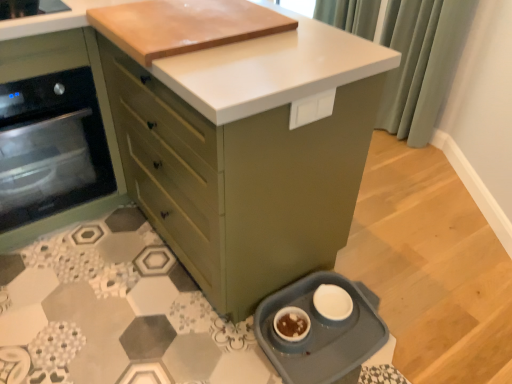
In order to face blue plastic pet dish at lower right, should I rotate leftwards or rightwards?

It's best to rotate right around 9.810 degrees.

Where is `matte green cabinet at center, arranged as the second cabinetry when viewed from the left`? matte green cabinet at center, arranged as the second cabinetry when viewed from the left is located at coordinates (234, 146).

What do you see at coordinates (292, 323) in the screenshot? I see `white matte bowl at lower center` at bounding box center [292, 323].

This screenshot has height=384, width=512. I want to click on blue plastic pet dish at lower right, so click(322, 333).

From a real-world perspective, which object rests below the other?

blue plastic pet dish at lower right is physically lower.

From the image's perspective, is matte green cabinet at center, the first cabinetry viewed from the right, under blue plastic pet dish at lower right?

No.

In terms of size, does matte green cabinet at center, the first cabinetry viewed from the right, appear bigger or smaller than blue plastic pet dish at lower right?

In the image, matte green cabinet at center, the first cabinetry viewed from the right, appears to be larger than blue plastic pet dish at lower right.

Measure the distance between white matte bowl at lower center and matte green oven at left, the second cabinetry viewed from the right.

They are 1.08 meters apart.

Based on their positions, is white matte bowl at lower center located to the left or right of matte green oven at left, the second cabinetry viewed from the right?

In the image, white matte bowl at lower center appears on the right side of matte green oven at left, the second cabinetry viewed from the right.

What are the coordinates of `appliance below the matte green oven at left, the second cabinetry viewed from the right (from a real-world perspective)` in the screenshot? It's located at (292, 323).

Is white matte bowl at lower center bigger or smaller than matte green oven at left, the 1th cabinetry in the left-to-right sequence?

white matte bowl at lower center is smaller than matte green oven at left, the 1th cabinetry in the left-to-right sequence.

Considering the sizes of objects matte green oven at left, the 1th cabinetry in the left-to-right sequence, and green fabric curtain at upper right in the image provided, who is shorter, matte green oven at left, the 1th cabinetry in the left-to-right sequence, or green fabric curtain at upper right?

Standing shorter between the two is matte green oven at left, the 1th cabinetry in the left-to-right sequence.

Considering the positions of point (108, 126) and point (403, 124), is point (108, 126) closer or farther from the camera than point (403, 124)?

Clearly, point (108, 126) is closer to the camera than point (403, 124).

Relative to green fabric curtain at upper right, is matte green oven at left, the second cabinetry viewed from the right, in front or behind?

matte green oven at left, the second cabinetry viewed from the right, is in front of green fabric curtain at upper right.

From the image's perspective, between blue plastic pet dish at lower right and white matte bowl at lower center, which one is located above?

blue plastic pet dish at lower right appears higher in the image.

Is point (348, 291) farther from camera compared to point (278, 319)?

Yes.

Is blue plastic pet dish at lower right not within white matte bowl at lower center?

blue plastic pet dish at lower right is positioned outside white matte bowl at lower center.

Based on the photo, in terms of height, does blue plastic pet dish at lower right look taller or shorter compared to white matte bowl at lower center?

Clearly, blue plastic pet dish at lower right is taller compared to white matte bowl at lower center.

Considering the sizes of objects matte green cabinet at center, the first cabinetry viewed from the right, and white matte bowl at lower center in the image provided, who is smaller, matte green cabinet at center, the first cabinetry viewed from the right, or white matte bowl at lower center?

white matte bowl at lower center is smaller.

How distant is matte green cabinet at center, the first cabinetry viewed from the right, from white matte bowl at lower center?

They are 25.40 inches apart.

Is matte green cabinet at center, the first cabinetry viewed from the right, further to camera compared to white matte bowl at lower center?

No, the depth of matte green cabinet at center, the first cabinetry viewed from the right, is less than that of white matte bowl at lower center.

Is white matte bowl at lower center located within matte green cabinet at center, arranged as the second cabinetry when viewed from the left?

No, matte green cabinet at center, arranged as the second cabinetry when viewed from the left, does not contain white matte bowl at lower center.

Is blue plastic pet dish at lower right wider than matte green cabinet at center, the first cabinetry viewed from the right?

In fact, blue plastic pet dish at lower right might be narrower than matte green cabinet at center, the first cabinetry viewed from the right.

Identify the location of the 2nd cabinetry above when counting from the blue plastic pet dish at lower right (from the image's perspective). Image resolution: width=512 pixels, height=384 pixels. (234, 146).

In the scene shown: Considering the relative sizes of blue plastic pet dish at lower right and matte green cabinet at center, arranged as the second cabinetry when viewed from the left, in the image provided, is blue plastic pet dish at lower right smaller than matte green cabinet at center, arranged as the second cabinetry when viewed from the left,?

Indeed, blue plastic pet dish at lower right has a smaller size compared to matte green cabinet at center, arranged as the second cabinetry when viewed from the left.

Identify the location of kitchen appliance below the matte green oven at left, the second cabinetry viewed from the right (from a real-world perspective). (x=322, y=333).

Is matte green oven at left, the second cabinetry viewed from the right, situated inside blue plastic pet dish at lower right or outside?

matte green oven at left, the second cabinetry viewed from the right, cannot be found inside blue plastic pet dish at lower right.

Considering the positions of objects matte green oven at left, the 1th cabinetry in the left-to-right sequence, and blue plastic pet dish at lower right in the image provided, who is in front, matte green oven at left, the 1th cabinetry in the left-to-right sequence, or blue plastic pet dish at lower right?

blue plastic pet dish at lower right is in front.

From the picture: From the image's perspective, is matte green oven at left, the 1th cabinetry in the left-to-right sequence, positioned above or below blue plastic pet dish at lower right?

Clearly, from the image's perspective, matte green oven at left, the 1th cabinetry in the left-to-right sequence, is above blue plastic pet dish at lower right.

Where is `cabinetry in front of the blue plastic pet dish at lower right`? cabinetry in front of the blue plastic pet dish at lower right is located at coordinates (234, 146).

The height and width of the screenshot is (384, 512). Identify the location of the 1st cabinetry positioned above the white matte bowl at lower center (from the image's perspective). (53, 71).

In the scene shown: Based on their spatial positions, is matte green oven at left, the 1th cabinetry in the left-to-right sequence, or matte green cabinet at center, the first cabinetry viewed from the right, closer to green fabric curtain at upper right?

matte green cabinet at center, the first cabinetry viewed from the right, is closer to green fabric curtain at upper right.

Which object lies further to the anchor point matte green cabinet at center, the first cabinetry viewed from the right, white matte bowl at lower center or green fabric curtain at upper right?

Based on the image, green fabric curtain at upper right appears to be further to matte green cabinet at center, the first cabinetry viewed from the right.

Based on their spatial positions, is matte green oven at left, the second cabinetry viewed from the right, or blue plastic pet dish at lower right closer to white matte bowl at lower center?

blue plastic pet dish at lower right is closer to white matte bowl at lower center.

Which object lies further to the anchor point matte green oven at left, the 1th cabinetry in the left-to-right sequence, matte green cabinet at center, arranged as the second cabinetry when viewed from the left, or white matte bowl at lower center?

Based on the image, white matte bowl at lower center appears to be further to matte green oven at left, the 1th cabinetry in the left-to-right sequence.

Which object lies further to the anchor point matte green oven at left, the 1th cabinetry in the left-to-right sequence, white matte bowl at lower center or green fabric curtain at upper right?

The object further to matte green oven at left, the 1th cabinetry in the left-to-right sequence, is green fabric curtain at upper right.

From the image, which object appears to be farther from green fabric curtain at upper right, matte green cabinet at center, the first cabinetry viewed from the right, or white matte bowl at lower center?

Among the two, white matte bowl at lower center is located further to green fabric curtain at upper right.

Which object lies nearer to the anchor point matte green cabinet at center, arranged as the second cabinetry when viewed from the left, matte green oven at left, the second cabinetry viewed from the right, or white matte bowl at lower center?

matte green oven at left, the second cabinetry viewed from the right, is positioned closer to the anchor matte green cabinet at center, arranged as the second cabinetry when viewed from the left.

Which object lies nearer to the anchor point white matte bowl at lower center, blue plastic pet dish at lower right or matte green cabinet at center, the first cabinetry viewed from the right?

The object closer to white matte bowl at lower center is blue plastic pet dish at lower right.

Where is `appliance located between matte green oven at left, the 1th cabinetry in the left-to-right sequence, and blue plastic pet dish at lower right in the left-right direction`? This screenshot has height=384, width=512. appliance located between matte green oven at left, the 1th cabinetry in the left-to-right sequence, and blue plastic pet dish at lower right in the left-right direction is located at coordinates (292, 323).

Image resolution: width=512 pixels, height=384 pixels. I want to click on appliance between matte green oven at left, the 1th cabinetry in the left-to-right sequence, and green fabric curtain at upper right from left to right, so click(292, 323).

The width and height of the screenshot is (512, 384). I want to click on kitchen appliance between green fabric curtain at upper right and white matte bowl at lower center vertically, so click(322, 333).

Locate an element on the screen. This screenshot has height=384, width=512. kitchen appliance between matte green cabinet at center, arranged as the second cabinetry when viewed from the left, and white matte bowl at lower center, in the vertical direction is located at coordinates (322, 333).